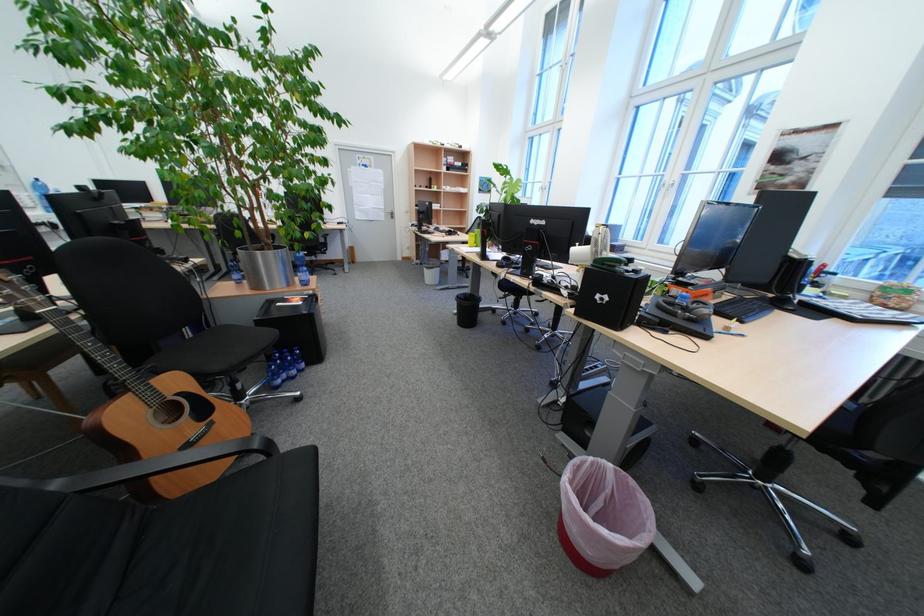
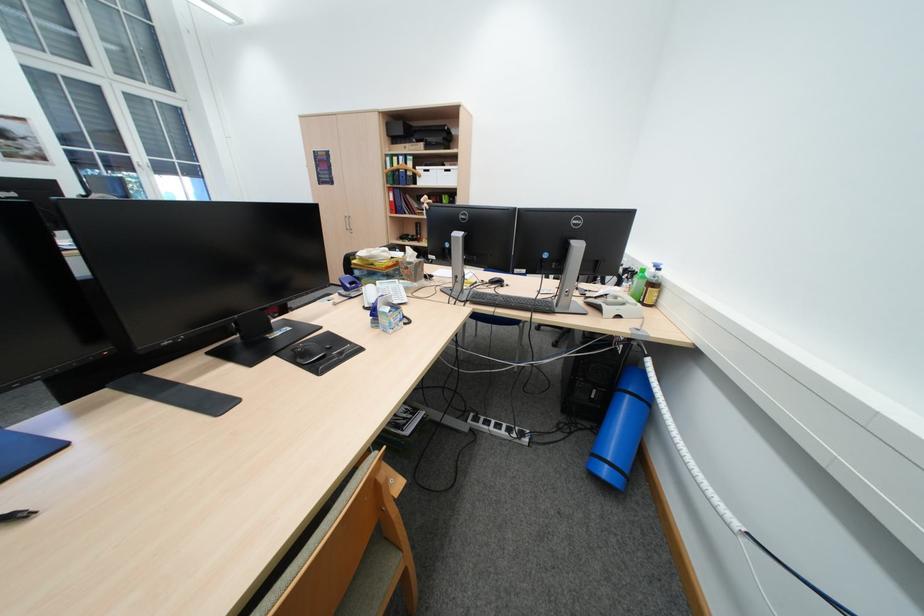
Question: I am providing you with two images of the same scene from different viewpoints. Which of the following objects are not visible in image2?

Choices:
 (A) black chair armrest
 (B) white floor lamp
 (C) green plastic bottle
 (D) white storage box

Answer: (A)